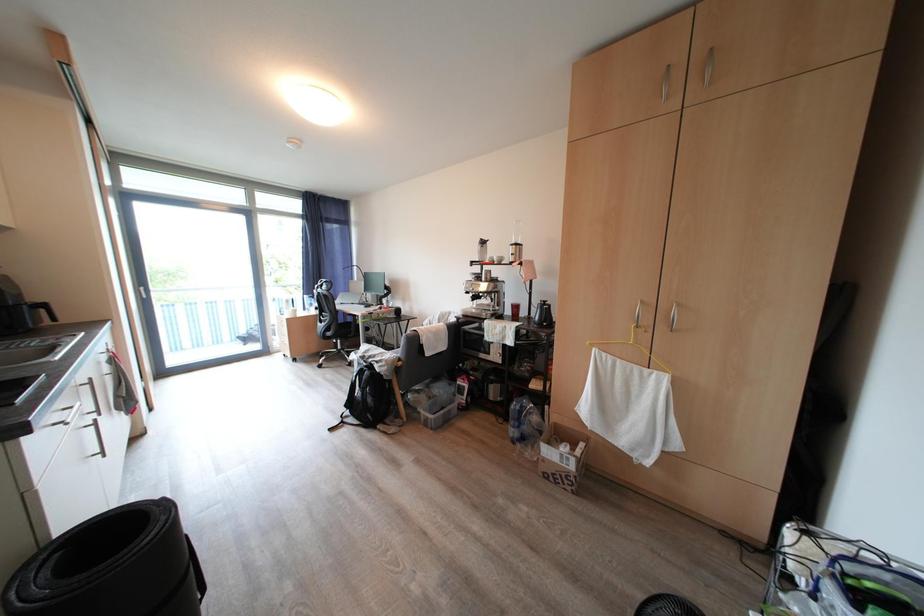
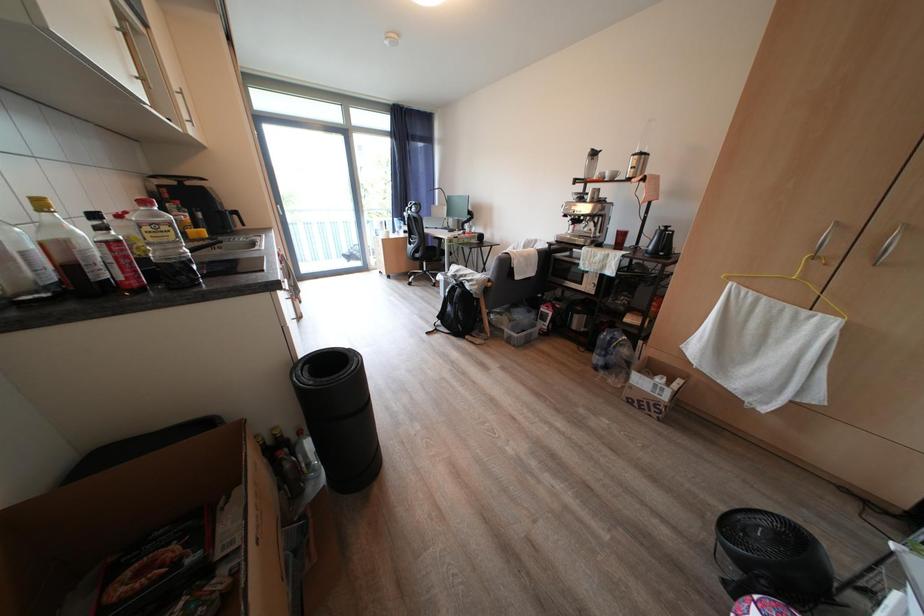
What movement of the cameraman would produce the second image?

The cameraman walked toward left, backward.